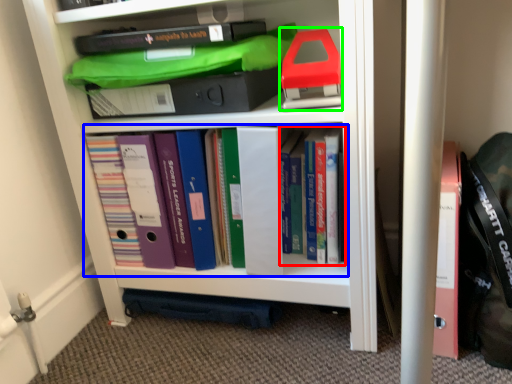
Question: Estimate the real-world distances between objects in this image. Which object is closer to book (highlighted by a red box), book (highlighted by a blue box) or book (highlighted by a green box)?

Choices:
 (A) book
 (B) book

Answer: (B)